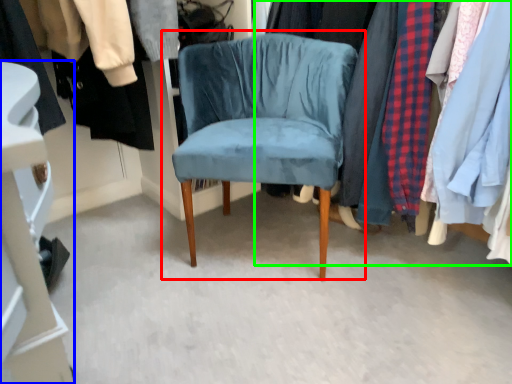
Question: Which object is the closest to the chair (highlighted by a red box)? Choose among these: closet (highlighted by a blue box) or closet (highlighted by a green box).

Choices:
 (A) closet
 (B) closet

Answer: (B)